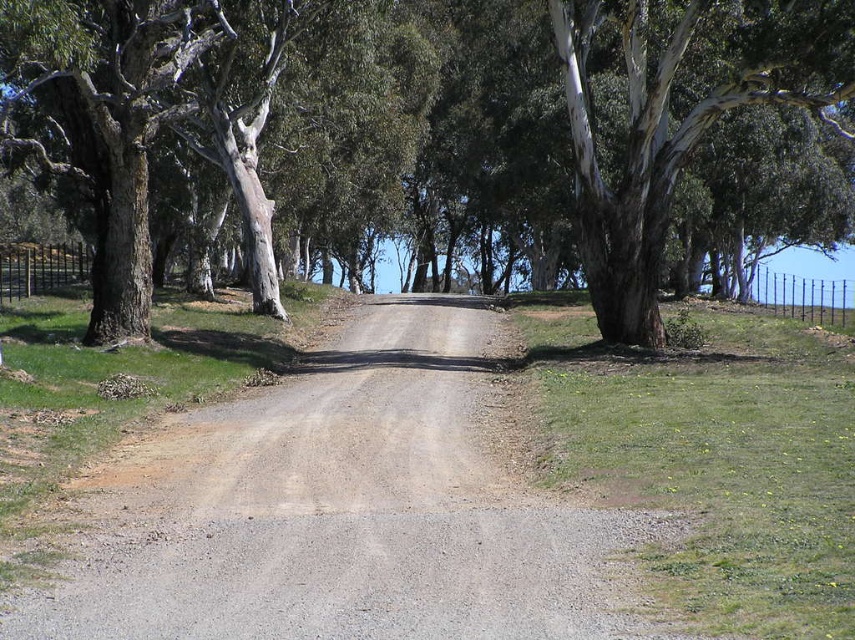
Question: Which object appears farthest from the camera in this image?

Choices:
 (A) white bark tree at center
 (B) gray gravel road at center

Answer: (A)

Question: Among these points, which one is nearest to the camera?

Choices:
 (A) (44, 92)
 (B) (184, 500)

Answer: (B)

Question: Which point is farther from the camera taking this photo?

Choices:
 (A) (319, 560)
 (B) (504, 221)

Answer: (B)

Question: Does white bark tree at center have a lesser width compared to gray gravel road at center?

Choices:
 (A) yes
 (B) no

Answer: (B)

Question: Does white bark tree at center appear on the right side of gray gravel road at center?

Choices:
 (A) no
 (B) yes

Answer: (B)

Question: Can you confirm if white bark tree at center is smaller than gray gravel road at center?

Choices:
 (A) yes
 (B) no

Answer: (B)